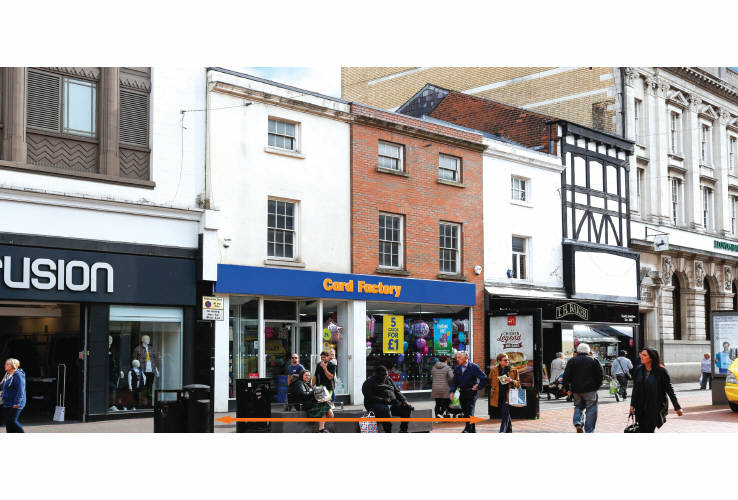
Find the location of `doorway`. doorway is located at coordinates (31, 361), (282, 333), (559, 334).